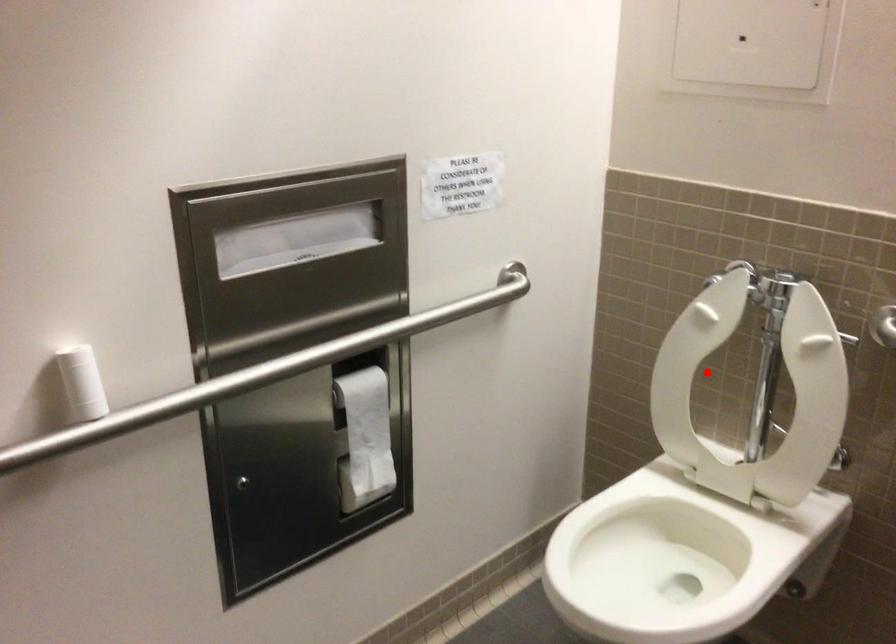
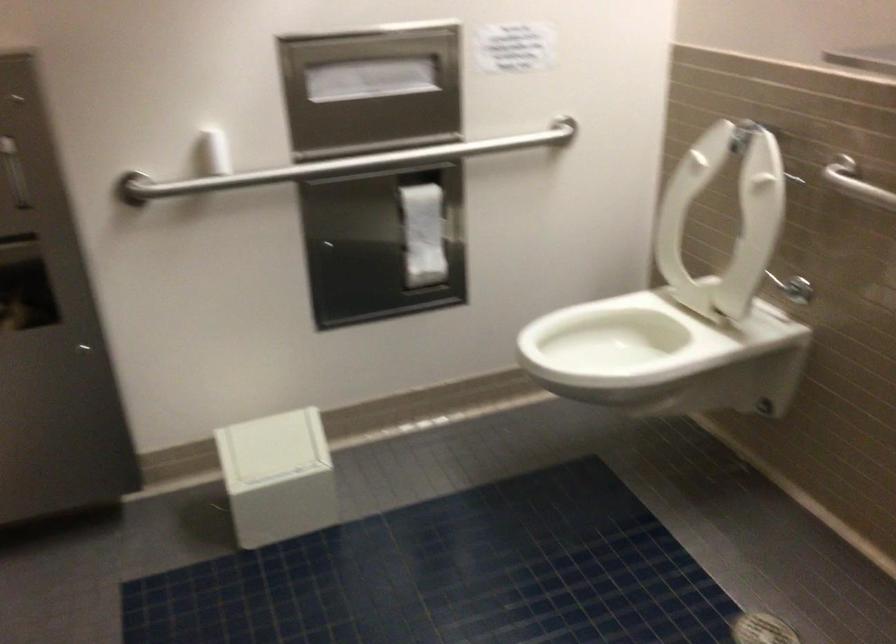
Question: I am providing you with two images of the same scene from different viewpoints. A red point is shown in image1. For the corresponding object point in image2, is it positioned nearer or farther from the camera?

Choices:
 (A) Nearer
 (B) Farther

Answer: (B)